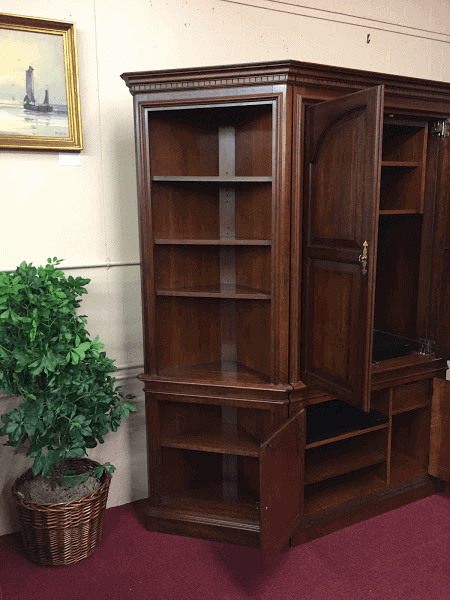
This screenshot has height=600, width=450. I want to click on basket, so click(x=63, y=526).